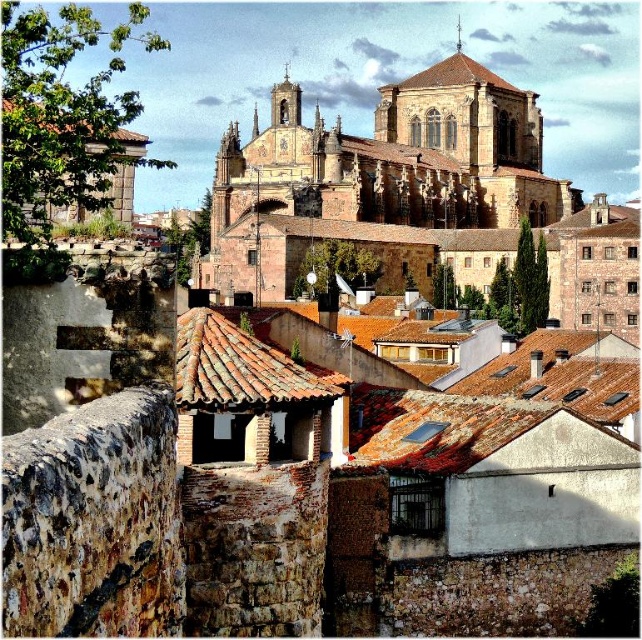
Question: Does brown stone church at center appear on the left side of brown tiled roof at upper center?

Choices:
 (A) no
 (B) yes

Answer: (A)

Question: Which object is the closest to the brown tiled roof at upper center?

Choices:
 (A) terracotta tiled roof at center
 (B) brown stone church at center

Answer: (B)

Question: Estimate the real-world distances between objects in this image. Which object is closer to the brown tiled roof at upper center?

Choices:
 (A) terracotta tiled roof at center
 (B) brown stone church at center

Answer: (B)

Question: Is terracotta tiled roof at center below brown tiled roof at upper center?

Choices:
 (A) no
 (B) yes

Answer: (B)

Question: Is terracotta tiled roof at center to the right of brown tiled roof at upper center from the viewer's perspective?

Choices:
 (A) no
 (B) yes

Answer: (A)

Question: Which of these objects is positioned farthest from the brown tiled roof at upper center?

Choices:
 (A) terracotta tiled roof at center
 (B) brown stone church at center

Answer: (A)